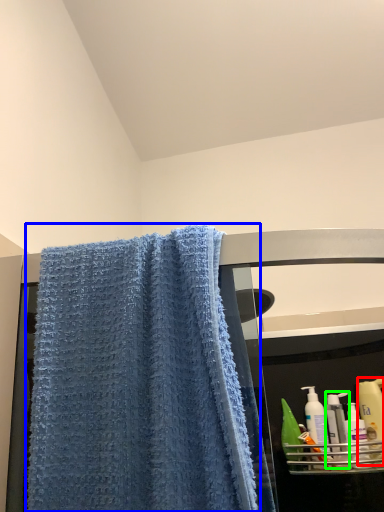
Question: Considering the real-world distances, which object is closest to cleaning product (highlighted by a red box)? towel (highlighted by a blue box) or mouthwash (highlighted by a green box).

Choices:
 (A) towel
 (B) mouthwash

Answer: (B)